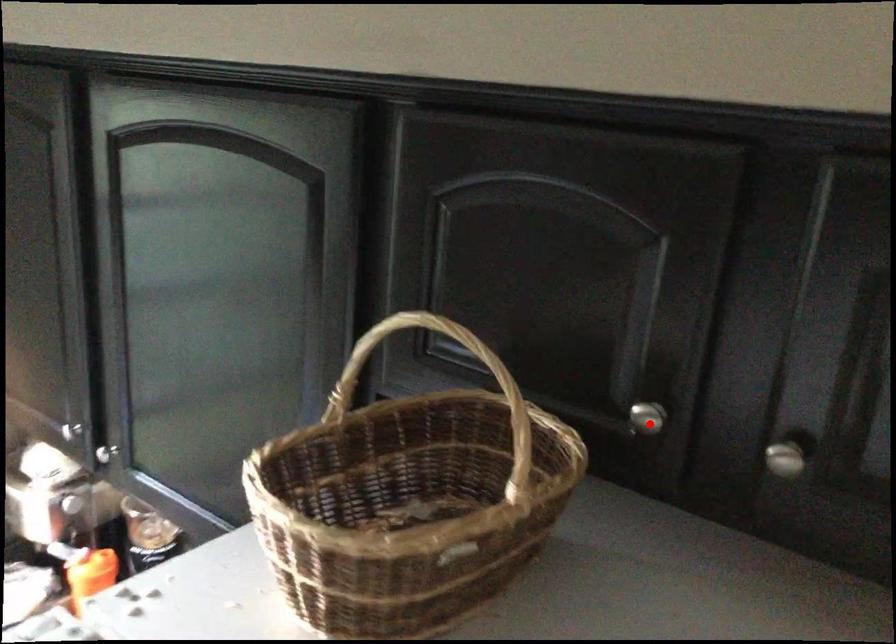
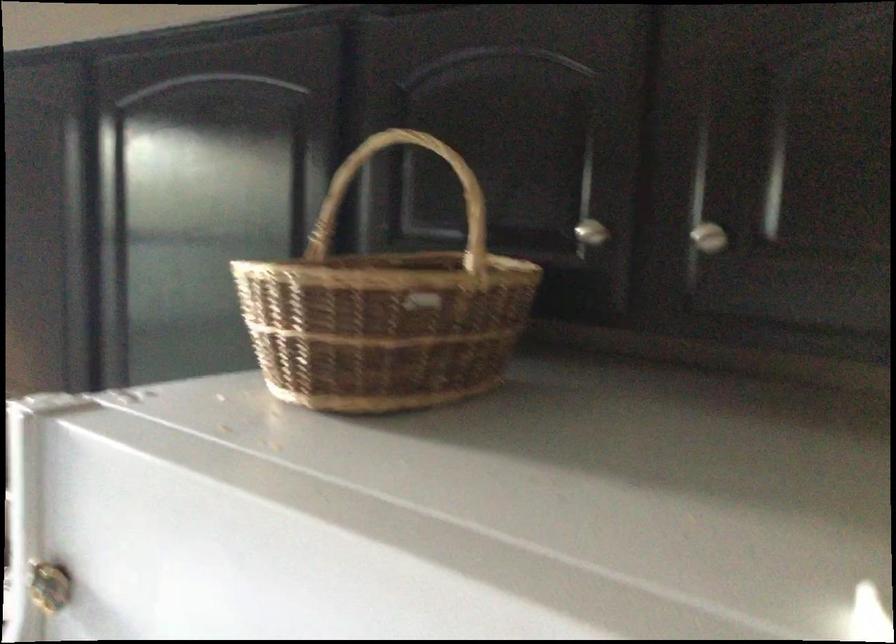
Find the pixel in the second image that matches the highlighted location in the first image.

(590, 232)